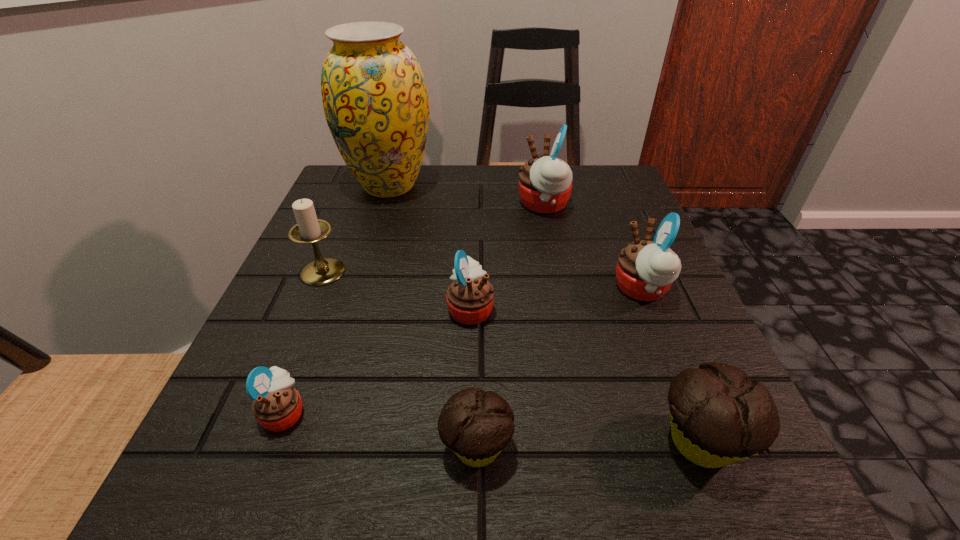
Choose which muffin is the second nearest neighbor to the third biggest pink muffin. Please provide its 2D coordinates. Your answer should be formatted as a tuple, i.e. [(x, y)], where the tuple contains the x and y coordinates of a point satisfying the conditions above.

[(645, 270)]

Where is `muffin that is the fifth closest to the second pink muffin from left to right`? The width and height of the screenshot is (960, 540). muffin that is the fifth closest to the second pink muffin from left to right is located at coordinates (718, 416).

What are the coordinates of `pink muffin that stands as the fourth closest to the bigger chocolate muffin` in the screenshot? It's located at (277, 406).

Identify which pink muffin is the second nearest to the third smallest pink muffin. Please provide its 2D coordinates. Your answer should be formatted as a tuple, i.e. [(x, y)], where the tuple contains the x and y coordinates of a point satisfying the conditions above.

[(470, 297)]

Where is `blank space that satisfies the following two spatial constraints: 1. on the front-facing side of the third pink muffin from right to left; 2. on the right side of the right chocolate muffin`? blank space that satisfies the following two spatial constraints: 1. on the front-facing side of the third pink muffin from right to left; 2. on the right side of the right chocolate muffin is located at coordinates (468, 441).

This screenshot has width=960, height=540. I want to click on free location that satisfies the following two spatial constraints: 1. on the front-facing side of the third pink muffin from right to left; 2. on the right side of the bigger chocolate muffin, so click(x=468, y=441).

Locate an element on the screen. This screenshot has height=540, width=960. blank space that satisfies the following two spatial constraints: 1. on the front-facing side of the second smallest pink muffin; 2. on the left side of the left chocolate muffin is located at coordinates click(468, 447).

The image size is (960, 540). What are the coordinates of `vacant area in the image that satisfies the following two spatial constraints: 1. on the front-facing side of the right chocolate muffin; 2. on the right side of the second pink muffin from right to left` in the screenshot? It's located at (591, 441).

Locate an element on the screen. The image size is (960, 540). free region that satisfies the following two spatial constraints: 1. on the front-facing side of the rightmost pink muffin; 2. on the front side of the smaller chocolate muffin is located at coordinates (707, 447).

Identify the location of vacant space that satisfies the following two spatial constraints: 1. on the front side of the yellow vase; 2. on the front-facing side of the leftmost muffin. The image size is (960, 540). (319, 413).